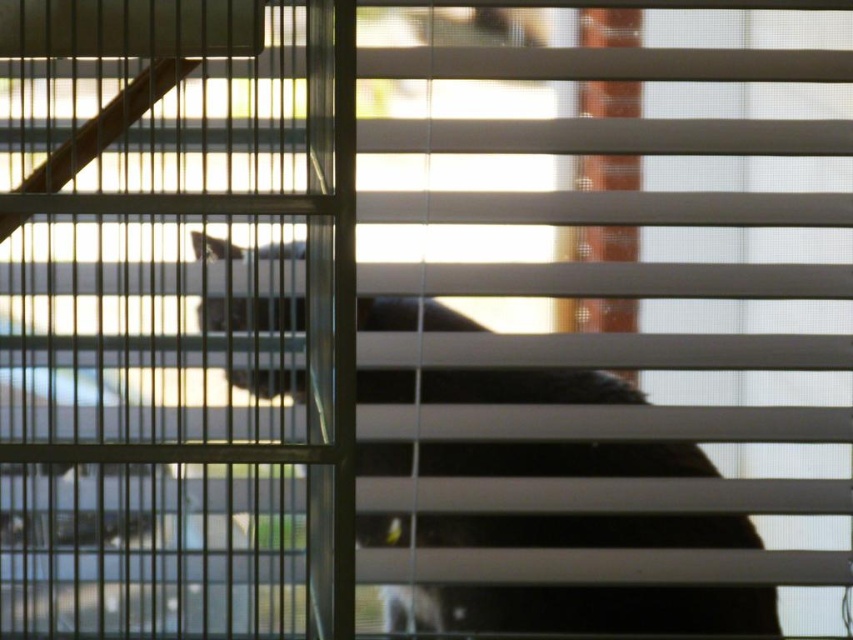
Question: Which of the following is the closest to the observer?

Choices:
 (A) metallic silver screen door at upper left
 (B) fluffy black cat at center

Answer: (A)

Question: Can you confirm if metallic silver screen door at upper left is positioned to the left of fluffy black cat at center?

Choices:
 (A) no
 (B) yes

Answer: (B)

Question: Does metallic silver screen door at upper left have a lesser width compared to fluffy black cat at center?

Choices:
 (A) yes
 (B) no

Answer: (A)

Question: Is metallic silver screen door at upper left bigger than fluffy black cat at center?

Choices:
 (A) no
 (B) yes

Answer: (A)

Question: Which of the following is the farthest from the observer?

Choices:
 (A) (579, 456)
 (B) (80, 108)

Answer: (A)